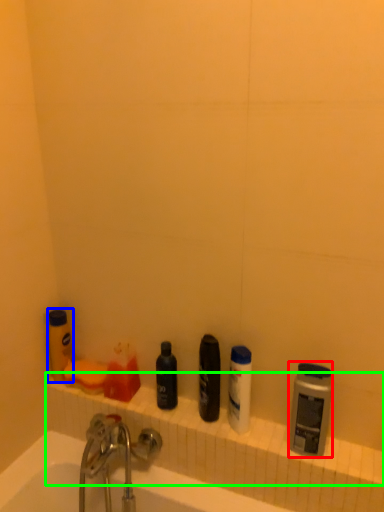
Question: Considering the real-world distances, which object is farthest from toiletry (highlighted by a red box)? toiletry (highlighted by a blue box) or ledge (highlighted by a green box)?

Choices:
 (A) toiletry
 (B) ledge

Answer: (A)